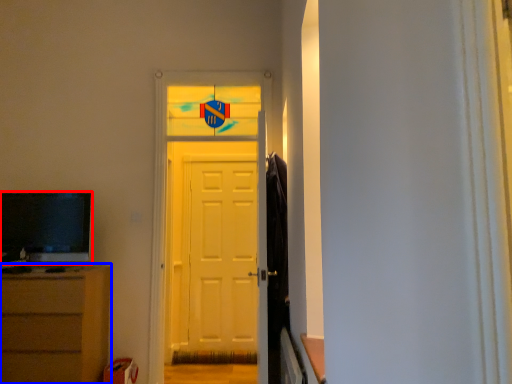
Question: Which object is closer to the camera taking this photo, television (highlighted by a red box) or chest of drawers (highlighted by a blue box)?

Choices:
 (A) television
 (B) chest of drawers

Answer: (B)